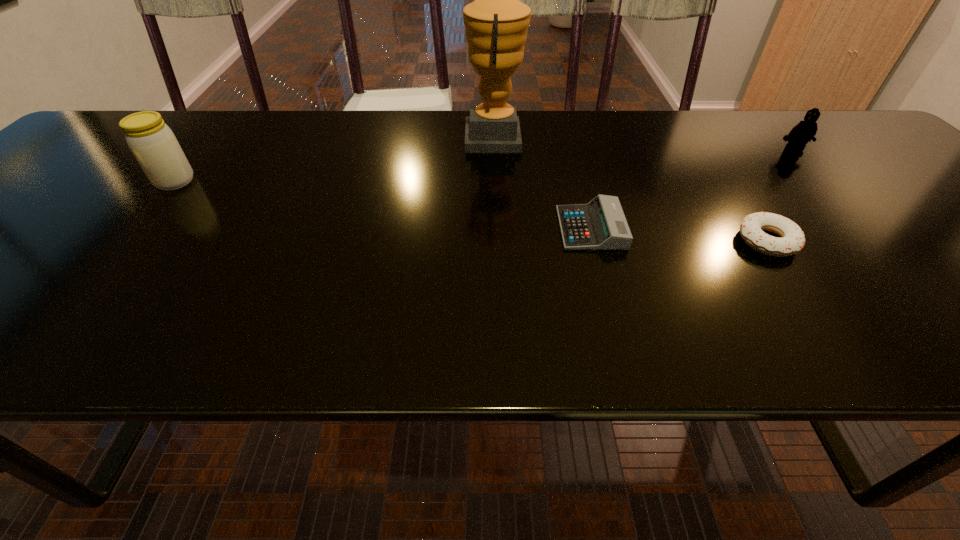
You are a GUI agent. You are given a task and a screenshot of the screen. Output one action in this format:
    pyautogui.click(x=<x>, y=<y>)
    Task: Click on the free area in between the calculator and the rightmost object
    
    Given the screenshot: What is the action you would take?
    pyautogui.click(x=691, y=191)

The image size is (960, 540). In order to click on object that ranks as the fourth closest to the leftmost object in this screenshot , I will do `click(804, 131)`.

At what (x,y) coordinates should I click in order to perform the action: click on object that can be found as the second closest to the doughnut. Please return your answer as a coordinate pair (x, y). This screenshot has width=960, height=540. Looking at the image, I should click on (804, 131).

Locate an element on the screen. free location that satisfies the following two spatial constraints: 1. at the front of the tallest object with handles; 2. on the front side of the third nearest object is located at coordinates (495, 181).

Identify the location of free space in the image that satisfies the following two spatial constraints: 1. at the front of the award with handles; 2. on the front side of the fourth shortest object. click(495, 181).

Identify the location of vacant area that satisfies the following two spatial constraints: 1. on the front side of the second object from right to left; 2. on the left side of the calculator. Image resolution: width=960 pixels, height=540 pixels. (594, 241).

At what (x,y) coordinates should I click in order to perform the action: click on vacant region that satisfies the following two spatial constraints: 1. at the front of the tallest object with handles; 2. on the right side of the calculator. Please return your answer as a coordinate pair (x, y). Looking at the image, I should click on (498, 228).